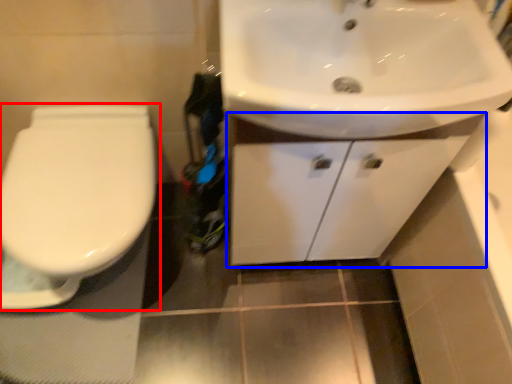
Question: Which object is closer to the camera taking this photo, toilet (highlighted by a red box) or bathroom cabinet (highlighted by a blue box)?

Choices:
 (A) toilet
 (B) bathroom cabinet

Answer: (B)